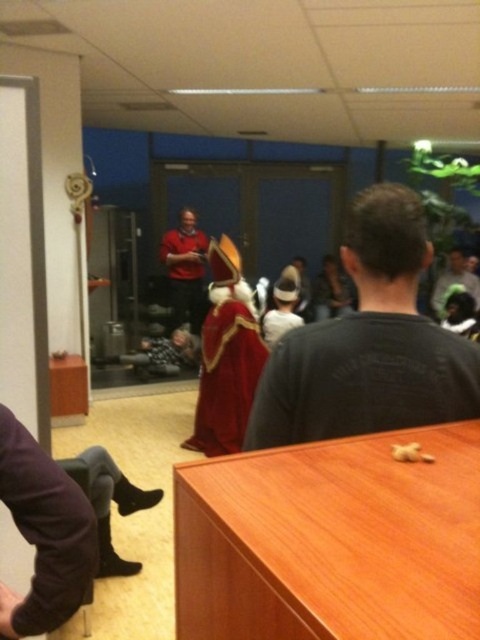
Question: Which point is closer to the camera?

Choices:
 (A) (34, 516)
 (B) (229, 433)
 (C) (479, 304)

Answer: (A)

Question: Can you confirm if black matte shirt at center is wider than velvet red cape at center?

Choices:
 (A) no
 (B) yes

Answer: (A)

Question: Which of these objects is positioned farthest from the dark gray cotton shirt at upper right?

Choices:
 (A) matte red shirt at center
 (B) velvet red cape at center
 (C) black matte shirt at center
 (D) purple fabric pants at lower left

Answer: (D)

Question: Which point appears farthest from the camera in this image?

Choices:
 (A) (466, 259)
 (B) (180, 323)
 (C) (412, 592)

Answer: (A)

Question: Does black matte shirt at center appear on the left side of purple fabric pants at lower left?

Choices:
 (A) yes
 (B) no

Answer: (B)

Question: Considering the relative positions of purple fabric pants at lower left and matte red shirt at center in the image provided, where is purple fabric pants at lower left located with respect to matte red shirt at center?

Choices:
 (A) below
 (B) above

Answer: (A)